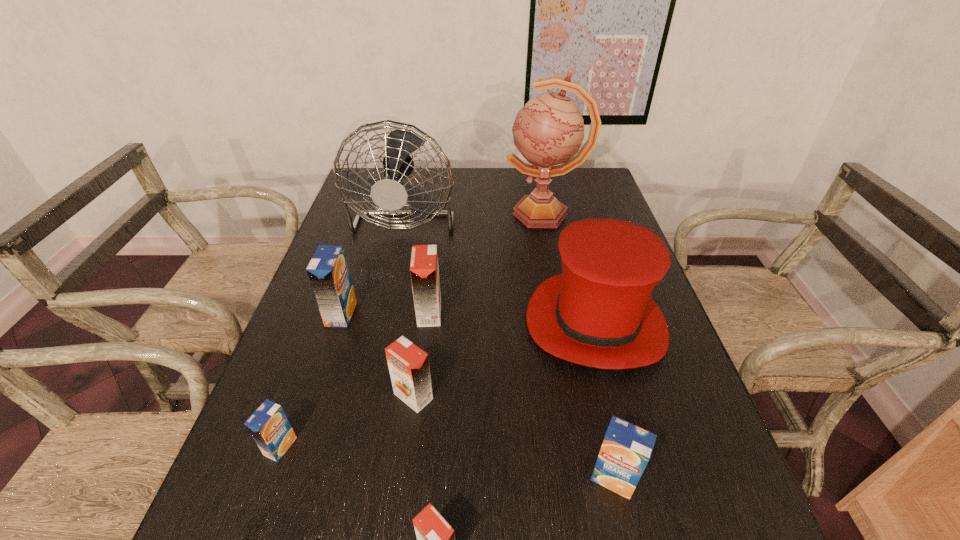
The height and width of the screenshot is (540, 960). What are the coordinates of `free region at the right edge` in the screenshot? It's located at (692, 445).

You are a GUI agent. You are given a task and a screenshot of the screen. Output one action in this format:
    pyautogui.click(x=<x>, y=<y>)
    Task: Click on the vacant point located between the farthest orange orange juice and the hat
    The height and width of the screenshot is (540, 960).
    Given the screenshot: What is the action you would take?
    pyautogui.click(x=513, y=318)

You are a GUI agent. You are given a task and a screenshot of the screen. Output one action in this format:
    pyautogui.click(x=<x>, y=<y>)
    Task: Click on the vacant area that lies between the biggest orange orange juice and the smallest blue orange_juice
    
    Given the screenshot: What is the action you would take?
    pyautogui.click(x=355, y=380)

The image size is (960, 540). Identify the location of blank region between the red hat and the biggest orange orange juice. (513, 318).

Find the location of `vacant point located between the second biggest orange orange juice and the tallest object`. vacant point located between the second biggest orange orange juice and the tallest object is located at coordinates (479, 305).

Identify the location of unoccupied position between the farthest blue orange_juice and the fourth nearest object. The width and height of the screenshot is (960, 540). (377, 355).

In order to click on object that can be found as the second closest to the smallest blue orange_juice in this screenshot , I will do `click(328, 272)`.

The width and height of the screenshot is (960, 540). I want to click on the fourth closest object to the second biggest blue orange_juice, so click(424, 270).

Identify the location of orange juice identified as the fourth closest to the pink globe. (626, 449).

What are the coordinates of `orange juice that can be found as the closest to the smallest orange orange juice` in the screenshot? It's located at (408, 364).